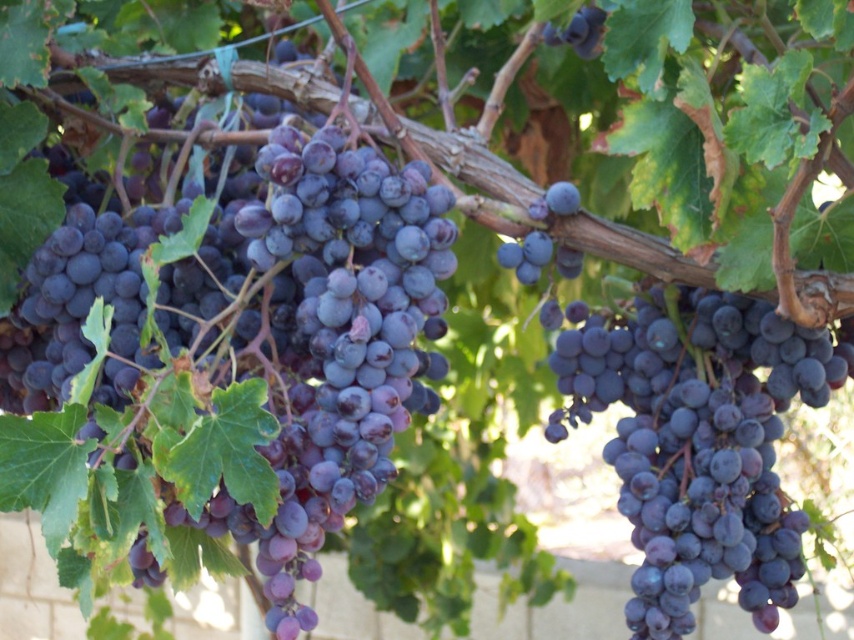
You are a farmer checking the grapevines. You notice two grapes of interest in the image. One is the shiny dark purple grapes at center and the other is the dark purple grape at upper right. Which of these two grapes is bigger?

The shiny dark purple grapes at center is larger in size than the dark purple grape at upper right.

Looking at this image, you are a farmer checking the grapevines. You notice the purple matte grapes at center and the dark purple grape at upper right. Which grape cluster is located lower in the image?

The purple matte grapes at center is positioned under the dark purple grape at upper right, so the purple matte grapes at center is lower in the image.

You are standing in a vineyard and see two points in the scene. The first point is at coordinate point (x=159, y=458) and the second is at point (x=547, y=42). Which point is nearer to you?

Point (x=159, y=458) is closer to the viewer than point (x=547, y=42).